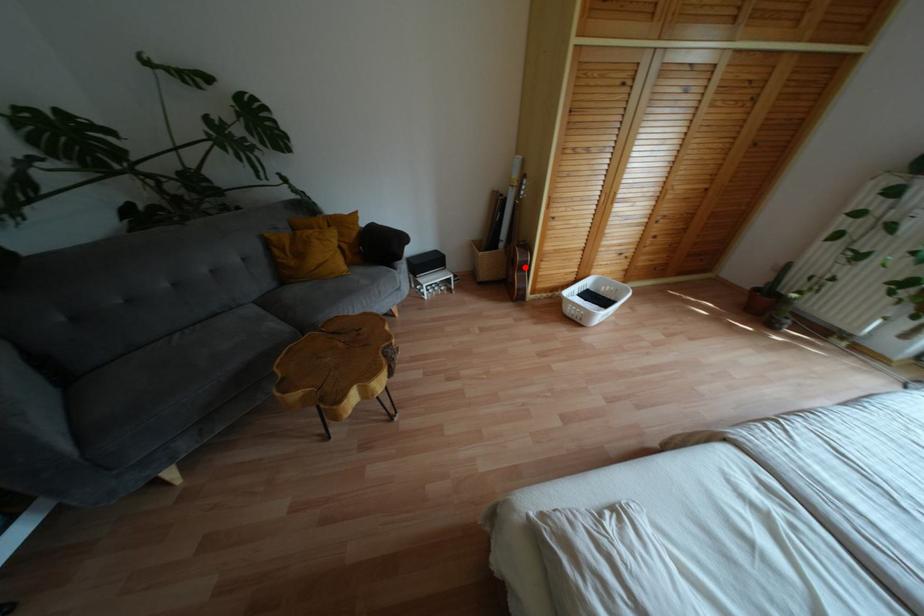
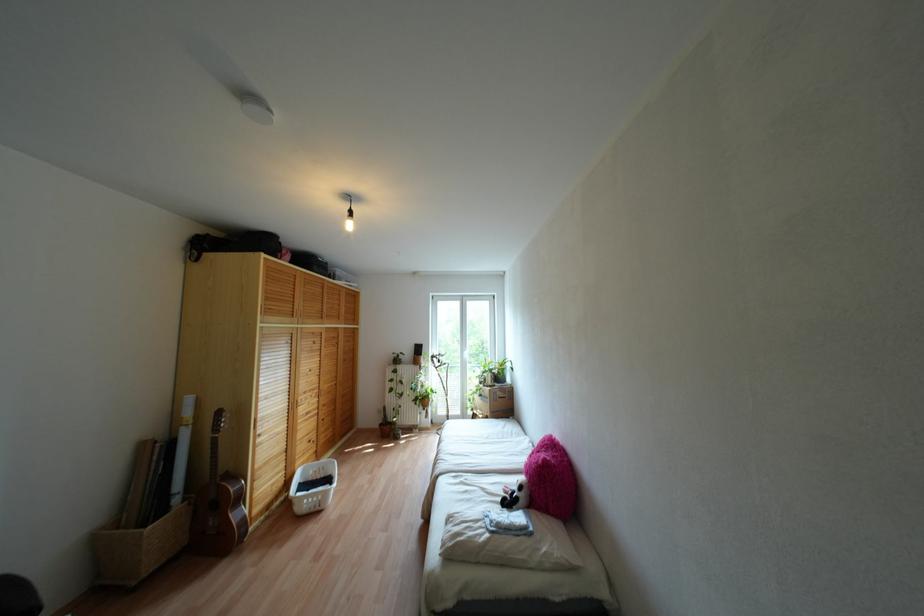
Question: I am providing you with two images of the same scene from different viewpoints. In image1, a red point is highlighted. Considering the same 3D point in image2, which of the following is correct?

Choices:
 (A) It is closer
 (B) It is farther

Answer: (A)